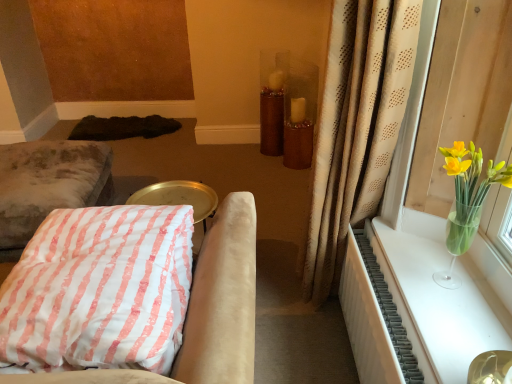
Question: From the image's perspective, does white textured radiator at right appear lower than velvet cushion at left, acting as the first furniture starting from the back?

Choices:
 (A) yes
 (B) no

Answer: (A)

Question: Considering the relative sizes of white textured radiator at right and velvet cushion at left, acting as the first furniture starting from the back, in the image provided, is white textured radiator at right wider than velvet cushion at left, acting as the first furniture starting from the back,?

Choices:
 (A) yes
 (B) no

Answer: (B)

Question: Considering the relative positions of white textured radiator at right and velvet cushion at left, the second furniture when ordered from right to left, in the image provided, is white textured radiator at right to the left of velvet cushion at left, the second furniture when ordered from right to left, from the viewer's perspective?

Choices:
 (A) no
 (B) yes

Answer: (A)

Question: From a real-world perspective, does white textured radiator at right stand above velvet cushion at left, acting as the first furniture starting from the back?

Choices:
 (A) yes
 (B) no

Answer: (A)

Question: Is white textured radiator at right bigger than velvet cushion at left, acting as the first furniture starting from the back?

Choices:
 (A) yes
 (B) no

Answer: (B)

Question: Is velvet cushion at left, acting as the first furniture starting from the back, spatially inside dark brown shaggy rug at lower left, or outside of it?

Choices:
 (A) inside
 (B) outside

Answer: (B)

Question: Is velvet cushion at left, placed as the first furniture when sorted from left to right, to the left or to the right of dark brown shaggy rug at lower left in the image?

Choices:
 (A) right
 (B) left

Answer: (B)

Question: From the image's perspective, is velvet cushion at left, placed as the second furniture when sorted from front to back, positioned above or below dark brown shaggy rug at lower left?

Choices:
 (A) above
 (B) below

Answer: (B)

Question: Is point (47, 195) closer or farther from the camera than point (94, 117)?

Choices:
 (A) closer
 (B) farther

Answer: (A)

Question: From a real-world perspective, is beige dotted curtain at right physically located above or below pink striped fabric cushion at lower left, the first furniture when ordered from right to left?

Choices:
 (A) below
 (B) above

Answer: (B)

Question: Is beige dotted curtain at right wider or thinner than pink striped fabric cushion at lower left, which is the second furniture from left to right?

Choices:
 (A) thin
 (B) wide

Answer: (A)

Question: Is beige dotted curtain at right bigger or smaller than pink striped fabric cushion at lower left, the first furniture in the front-to-back sequence?

Choices:
 (A) big
 (B) small

Answer: (A)

Question: Is beige dotted curtain at right in front of or behind pink striped fabric cushion at lower left, which is counted as the second furniture, starting from the back, in the image?

Choices:
 (A) behind
 (B) front

Answer: (A)

Question: Considering the relative positions of white textured radiator at right and brown glittery vase at center in the image provided, is white textured radiator at right to the left or to the right of brown glittery vase at center?

Choices:
 (A) right
 (B) left

Answer: (A)

Question: Is white textured radiator at right spatially inside brown glittery vase at center, or outside of it?

Choices:
 (A) outside
 (B) inside

Answer: (A)